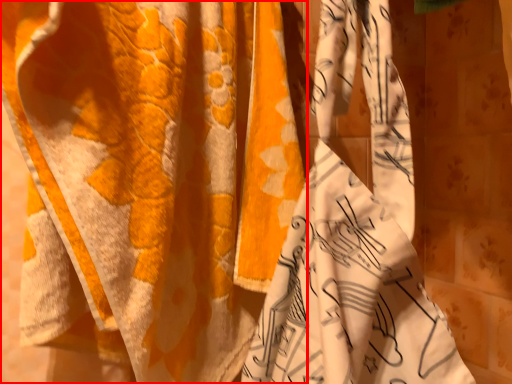
Question: Where is curtain (annotated by the red box) located in relation to curtain in the image?

Choices:
 (A) right
 (B) left

Answer: (B)